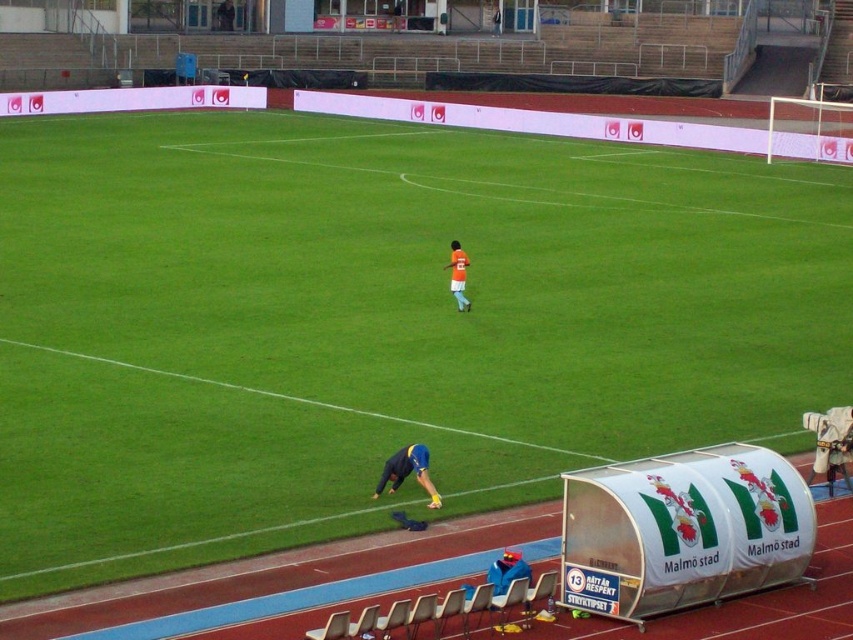
Does point (523, 566) come farther from viewer compared to point (453, 272)?

No, it is in front of (453, 272).

Does blue fabric jacket at lower center have a greater height compared to orange jersey at center?

No.

Between point (494, 577) and point (453, 292), which one is positioned in front?

Positioned in front is point (494, 577).

At what (x,y) coordinates should I click in order to perform the action: click on blue fabric jacket at lower center. Please return your answer as a coordinate pair (x, y). Looking at the image, I should click on (508, 572).

Who is shorter, blue fabric at lower center or orange jersey at center?

With less height is blue fabric at lower center.

Can you confirm if blue fabric at lower center is shorter than orange jersey at center?

Indeed, blue fabric at lower center has a lesser height compared to orange jersey at center.

Is point (409, 451) less distant than point (461, 269)?

Yes, it is in front of point (461, 269).

Identify the location of blue fabric at lower center. (408, 472).

Between blue fabric at lower center and blue fabric jacket at lower center, which one is positioned higher?

blue fabric at lower center is higher up.

Is blue fabric at lower center behind blue fabric jacket at lower center?

Yes, it is behind blue fabric jacket at lower center.

Is point (392, 481) in front of point (498, 557)?

No.

Find the location of a particular element. This screenshot has height=640, width=853. blue fabric at lower center is located at coordinates (408, 472).